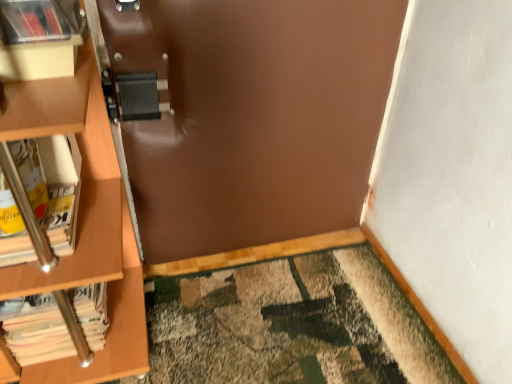
Question: Is matte plastic shelf at upper left further to the viewer compared to matte plastic book at upper left, which ranks as the 1th book in top-to-bottom order?

Choices:
 (A) no
 (B) yes

Answer: (B)

Question: Can you confirm if matte plastic shelf at upper left is taller than matte plastic book at upper left, which ranks as the 1th book in top-to-bottom order?

Choices:
 (A) yes
 (B) no

Answer: (B)

Question: Is matte plastic shelf at upper left positioned in front of matte plastic book at upper left, which ranks as the 1th book in top-to-bottom order?

Choices:
 (A) no
 (B) yes

Answer: (A)

Question: From the image's perspective, is matte plastic shelf at upper left located beneath matte plastic book at upper left, the 3th book when ordered from bottom to top?

Choices:
 (A) yes
 (B) no

Answer: (A)

Question: Does matte plastic shelf at upper left have a larger size compared to matte plastic book at upper left, which ranks as the 1th book in top-to-bottom order?

Choices:
 (A) no
 (B) yes

Answer: (A)

Question: From the image's perspective, relative to white paper book at left, the 2th book in the top-to-bottom sequence, is matte plastic shelf at upper left above or below?

Choices:
 (A) below
 (B) above

Answer: (B)

Question: Is point (26, 59) closer or farther from the camera than point (52, 226)?

Choices:
 (A) closer
 (B) farther

Answer: (A)

Question: Based on their positions, is matte plastic shelf at upper left located to the left or right of white paper book at left, the 2th book in the top-to-bottom sequence?

Choices:
 (A) left
 (B) right

Answer: (B)

Question: From a real-world perspective, is matte plastic shelf at upper left physically located above or below white paper book at left, the 2th book in the bottom-to-top sequence?

Choices:
 (A) above
 (B) below

Answer: (A)

Question: In the image, is matte plastic book at upper left, which ranks as the 1th book in top-to-bottom order, on the left side or the right side of white paper book at left, the 3th book in the top-to-bottom sequence?

Choices:
 (A) left
 (B) right

Answer: (B)

Question: From the image's perspective, is matte plastic book at upper left, which ranks as the 1th book in top-to-bottom order, positioned above or below white paper book at left, the 3th book in the top-to-bottom sequence?

Choices:
 (A) below
 (B) above

Answer: (B)

Question: Considering the positions of matte plastic book at upper left, the 3th book when ordered from bottom to top, and white paper book at left, the 3th book in the top-to-bottom sequence, in the image, is matte plastic book at upper left, the 3th book when ordered from bottom to top, taller or shorter than white paper book at left, the 3th book in the top-to-bottom sequence,?

Choices:
 (A) tall
 (B) short

Answer: (B)

Question: Is matte plastic book at upper left, which ranks as the 1th book in top-to-bottom order, wider or thinner than white paper book at left, the 3th book in the top-to-bottom sequence?

Choices:
 (A) wide
 (B) thin

Answer: (B)

Question: Relative to white paper book at left, the 2th book in the bottom-to-top sequence, is matte plastic book at upper left, the 3th book when ordered from bottom to top, in front or behind?

Choices:
 (A) behind
 (B) front

Answer: (B)

Question: From a real-world perspective, relative to white paper book at left, the 2th book in the top-to-bottom sequence, is matte plastic book at upper left, which ranks as the 1th book in top-to-bottom order, vertically above or below?

Choices:
 (A) below
 (B) above

Answer: (B)